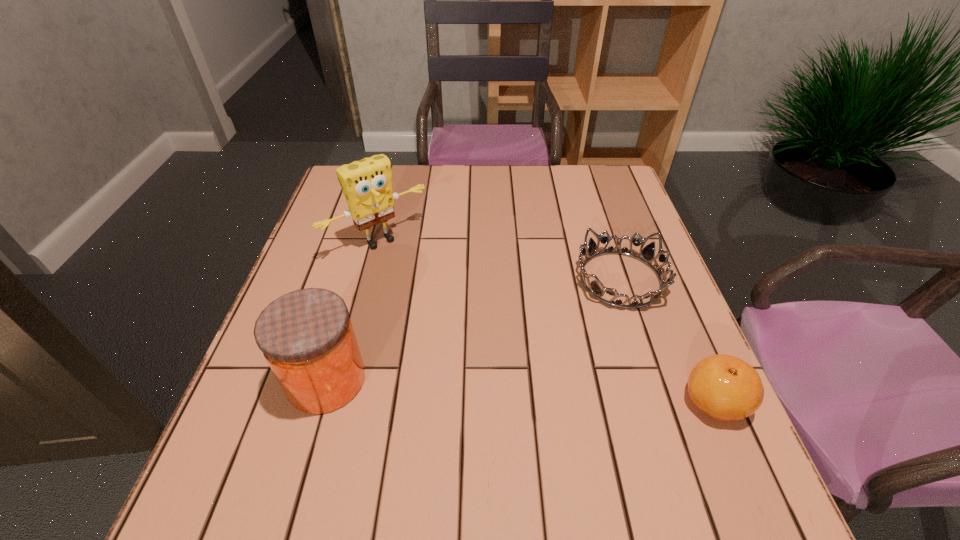
The height and width of the screenshot is (540, 960). I want to click on free spot between the sponge and the clementine, so click(547, 321).

In order to click on unoccupied position between the sponge and the tiara in this screenshot , I will do `click(500, 260)`.

Locate an element on the screen. vacant point located between the tiara and the clementine is located at coordinates (667, 340).

Locate an element on the screen. Image resolution: width=960 pixels, height=540 pixels. vacant region between the clementine and the sponge is located at coordinates (547, 321).

You are a GUI agent. You are given a task and a screenshot of the screen. Output one action in this format:
    pyautogui.click(x=<x>, y=<y>)
    Task: Click on the free space that is in between the clementine and the tiara
    This screenshot has height=540, width=960.
    Given the screenshot: What is the action you would take?
    pyautogui.click(x=667, y=340)

Identify the location of object that is the third nearest to the sponge. This screenshot has width=960, height=540. (726, 388).

I want to click on object that is the third closest one to the tiara, so click(306, 336).

The height and width of the screenshot is (540, 960). In order to click on free spot that satisfies the following two spatial constraints: 1. on the front side of the sponge; 2. on the left side of the clementine in this screenshot , I will do `click(337, 401)`.

This screenshot has height=540, width=960. Identify the location of free spot that satisfies the following two spatial constraints: 1. on the back side of the tiara; 2. on the right side of the jar. (356, 279).

I want to click on vacant space that satisfies the following two spatial constraints: 1. on the back side of the tiara; 2. on the left side of the second tallest object, so click(356, 279).